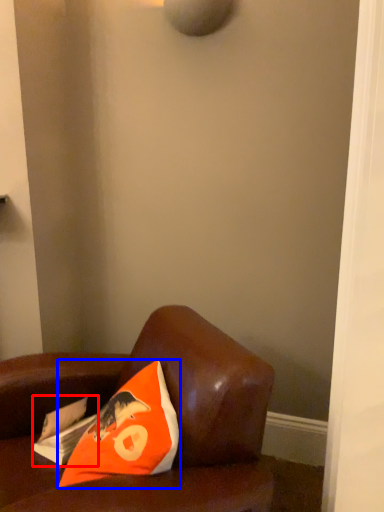
Question: Which object appears closest to the camera in this image, magazine (highlighted by a red box) or pillow (highlighted by a blue box)?

Choices:
 (A) magazine
 (B) pillow

Answer: (B)